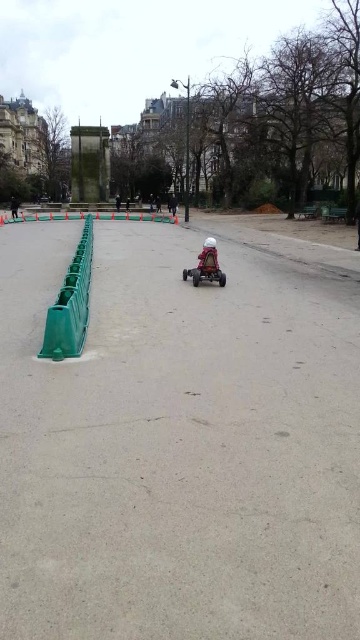
You are a parent supervising a child in a park. You see a matte red toy car at center and a matte red car at center. Which one is shorter in height?

The matte red toy car at center is not as tall as the matte red car at center, so the matte red toy car at center is shorter in height.

Consider the image. You are a parent watching your child play with the matte red toy car at center and the matte red car at center in the park. You want to ensure there is enough space for them to maneuver safely. Based on the scene, which object is wider and could potentially require more space?

The matte red toy car at center is wider than the matte red car at center, so it would require more space for safe maneuvering.

You are standing at the point labeled point (12, 208) and want to walk to the point labeled point (205, 257). Which direction should you face to walk directly towards your destination?

You should face towards the direction of point (205, 257), which is in front of point (12, 208) according to the scene description.